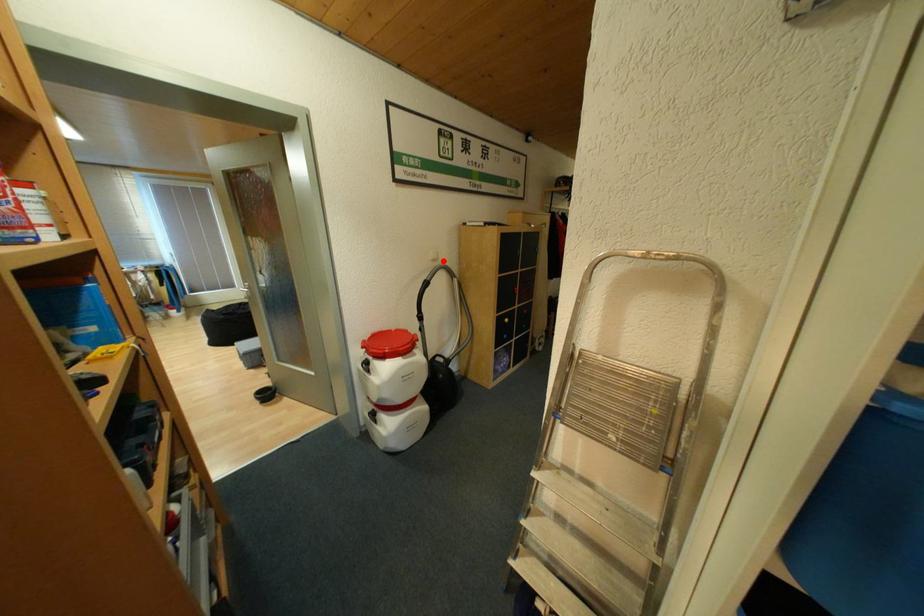
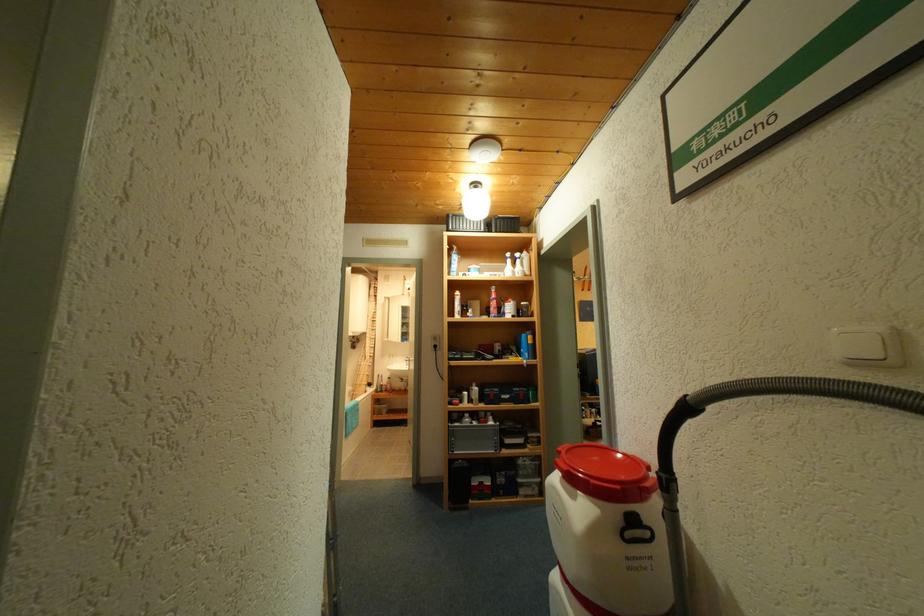
Question: I am providing you with two images of the same scene from different viewpoints. In image1, a red point is highlighted. Considering the same 3D point in image2, which of the following is correct?

Choices:
 (A) It is closer
 (B) It is farther

Answer: (B)